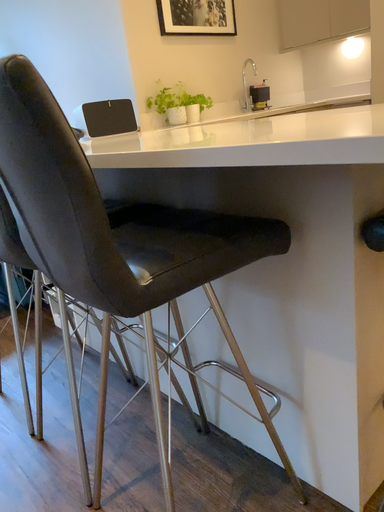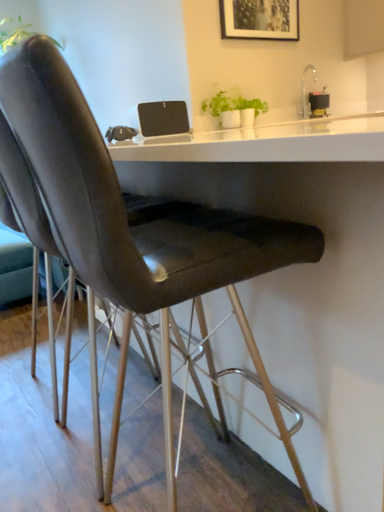
Question: Which way did the camera rotate in the video?

Choices:
 (A) rotated left
 (B) rotated right

Answer: (A)